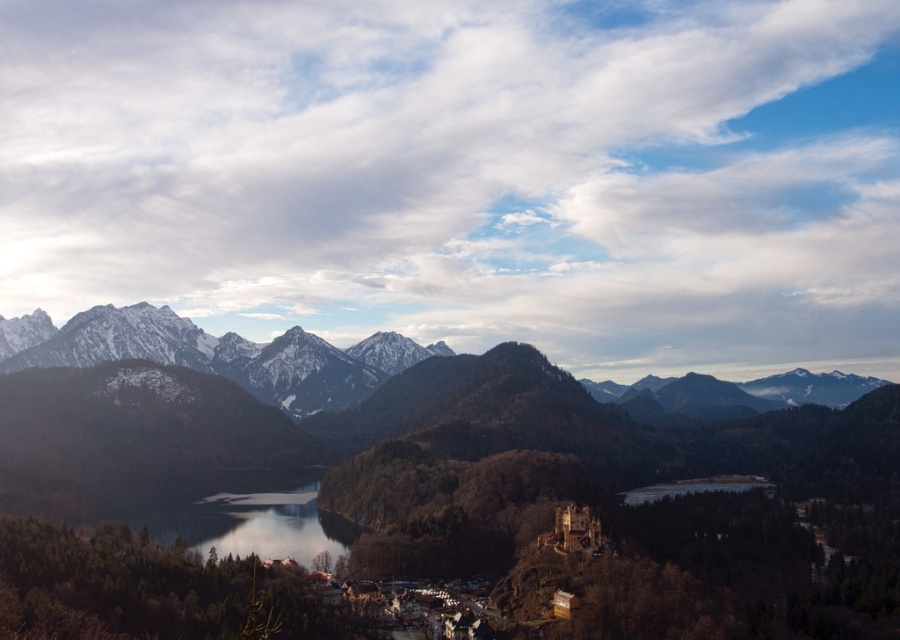
Which is more to the left, snowy rocky mountains at upper left or transparent glass lake at center?

From the viewer's perspective, transparent glass lake at center appears more on the left side.

I want to click on snowy rocky mountains at upper left, so click(216, 355).

Identify the location of snowy rocky mountains at upper left. (216, 355).